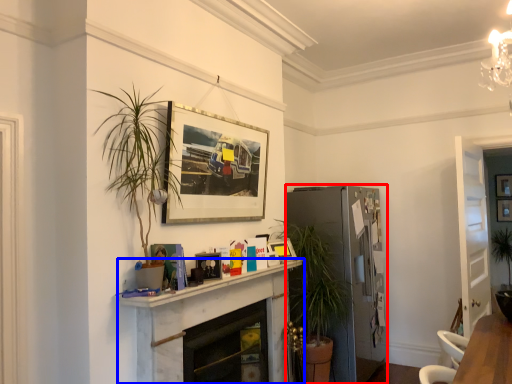
Question: Which object is closer to the camera taking this photo, fridge (highlighted by a red box) or fireplace (highlighted by a blue box)?

Choices:
 (A) fridge
 (B) fireplace

Answer: (B)